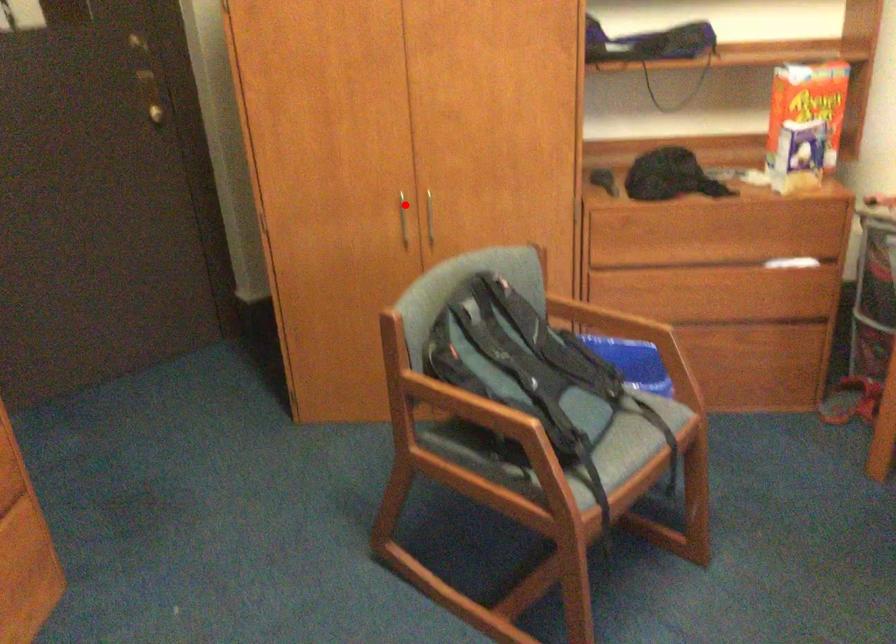
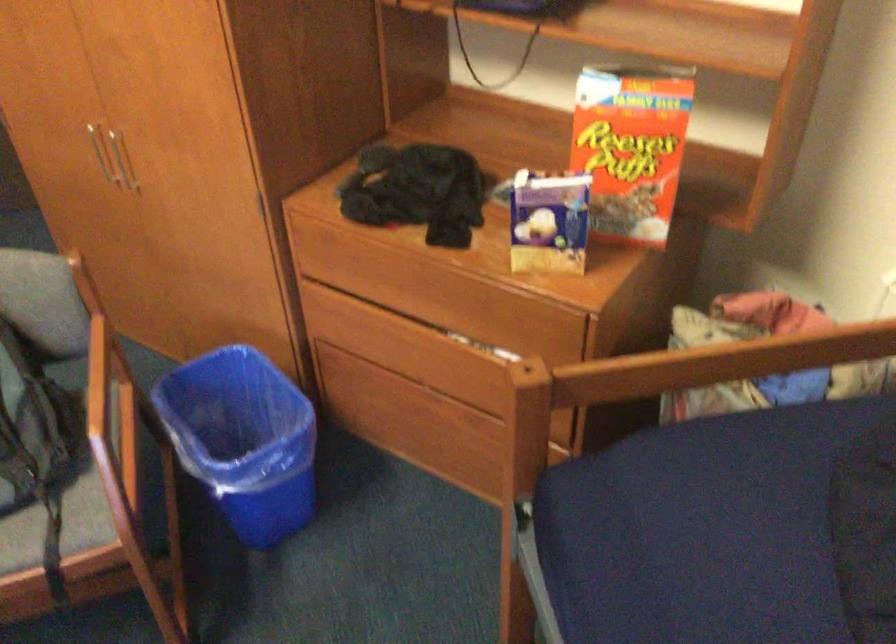
Where in the second image is the point corresponding to the highlighted location from the first image?

(97, 149)